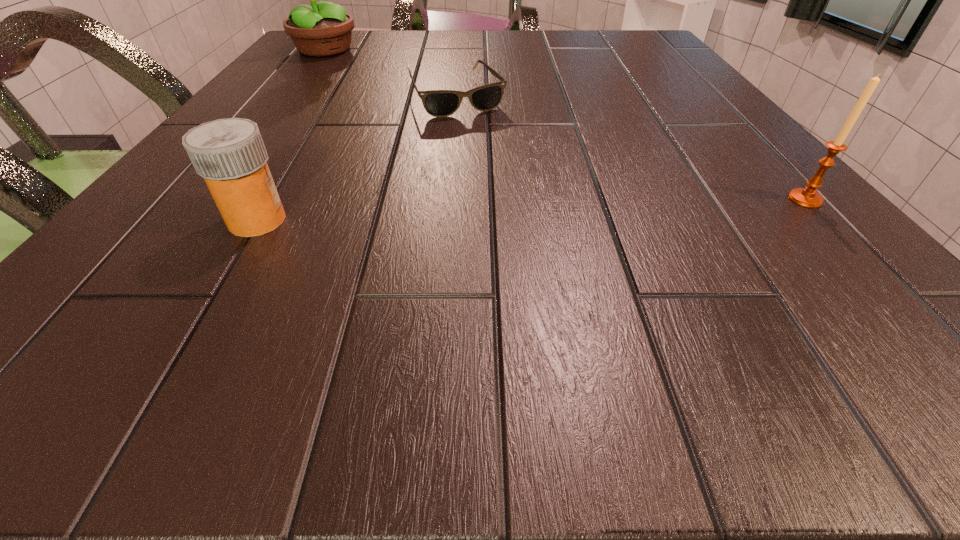
Locate an element on the screen. vacant space that is in between the farthest object and the candle_holder is located at coordinates (564, 125).

What are the coordinates of `vacant area that lies between the second shortest object and the third shortest object` in the screenshot? It's located at (531, 210).

Where is `vacant area between the medicine and the farthest object`? The width and height of the screenshot is (960, 540). vacant area between the medicine and the farthest object is located at coordinates (291, 135).

I want to click on vacant space that's between the third tallest object and the sunflower, so click(x=291, y=135).

I want to click on free area in between the rightmost object and the medicine, so click(x=531, y=210).

Identify the location of free space that is in between the medicine and the third shortest object. (531, 210).

Image resolution: width=960 pixels, height=540 pixels. In order to click on free spot between the second shortest object and the rightmost object in this screenshot , I will do point(531,210).

The image size is (960, 540). In order to click on empty space between the sunflower and the candle_holder in this screenshot , I will do `click(564, 125)`.

Identify the location of object that stands as the third closest to the sunflower. (807, 197).

Identify the location of the second closest object relative to the third shortest object. (230, 155).